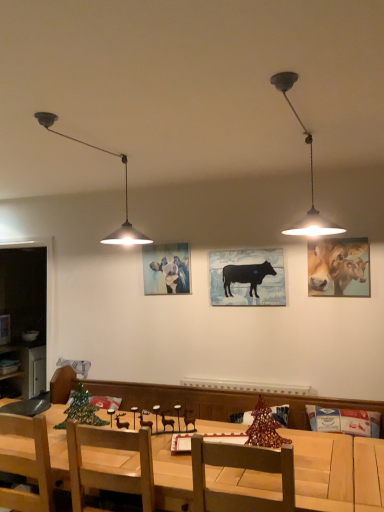
What are the coordinates of `vacant area on top of metallic pendant light at left, marked as the 1th lamp in a left-to-right arrangement (from a real-world perspective)` in the screenshot? It's located at (93, 141).